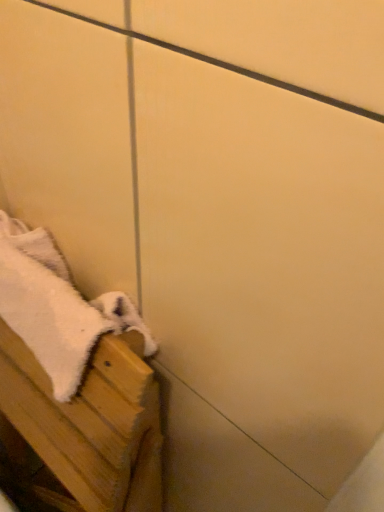
The image size is (384, 512). What do you see at coordinates (56, 307) in the screenshot? I see `white fluffy towel at lower left` at bounding box center [56, 307].

Where is `white fluffy towel at lower left`? Image resolution: width=384 pixels, height=512 pixels. white fluffy towel at lower left is located at coordinates (56, 307).

What is the approximate height of white fluffy towel at lower left?

5.61 inches.

Where is `white fluffy towel at lower left`? Image resolution: width=384 pixels, height=512 pixels. white fluffy towel at lower left is located at coordinates (91, 423).

Describe the element at coordinates (91, 423) in the screenshot. The width and height of the screenshot is (384, 512). I see `white fluffy towel at lower left` at that location.

Where is `white fluffy towel at lower left`? This screenshot has height=512, width=384. white fluffy towel at lower left is located at coordinates (56, 307).

Visually, is white fluffy towel at lower left positioned to the left or to the right of white fluffy towel at lower left?

white fluffy towel at lower left is positioned on white fluffy towel at lower left's right side.

Which is in front, white fluffy towel at lower left or white fluffy towel at lower left?

white fluffy towel at lower left is in front.

Which is in front, point (6, 323) or point (56, 443)?

The point (56, 443) is more forward.

From the image's perspective, is white fluffy towel at lower left on white fluffy towel at lower left?

Yes, from the image's perspective, white fluffy towel at lower left is over white fluffy towel at lower left.

From a real-world perspective, which object rests below the other?

In real-world perspective, white fluffy towel at lower left is lower.

Which of these two, white fluffy towel at lower left or white fluffy towel at lower left, is wider?

white fluffy towel at lower left.

From the picture: Which of these two, white fluffy towel at lower left or white fluffy towel at lower left, stands shorter?

white fluffy towel at lower left.

Which of these two, white fluffy towel at lower left or white fluffy towel at lower left, is smaller?

white fluffy towel at lower left.

Is white fluffy towel at lower left inside or outside of white fluffy towel at lower left?

white fluffy towel at lower left fits inside white fluffy towel at lower left.

Can you see white fluffy towel at lower left touching white fluffy towel at lower left?

Yes, the surface of white fluffy towel at lower left is in contact with white fluffy towel at lower left.

Could you tell me if white fluffy towel at lower left is turned towards white fluffy towel at lower left?

Yes, white fluffy towel at lower left faces towards white fluffy towel at lower left.

How far apart are white fluffy towel at lower left and white fluffy towel at lower left?

They are 3.17 inches apart.

I want to click on bath towel located on the right of white fluffy towel at lower left, so click(x=56, y=307).

Is white fluffy towel at lower left to the right of white fluffy towel at lower left from the viewer's perspective?

No, white fluffy towel at lower left is not to the right of white fluffy towel at lower left.

Relative to white fluffy towel at lower left, is white fluffy towel at lower left in front or behind?

In the image, white fluffy towel at lower left appears in front of white fluffy towel at lower left.

Is point (46, 425) in front of point (9, 296)?

No, (46, 425) is further to viewer.

From the image's perspective, relative to white fluffy towel at lower left, is white fluffy towel at lower left above or below?

white fluffy towel at lower left is situated lower than white fluffy towel at lower left in the image.

From a real-world perspective, is white fluffy towel at lower left beneath white fluffy towel at lower left?

Indeed, from a real-world perspective, white fluffy towel at lower left is positioned beneath white fluffy towel at lower left.

Considering the relative sizes of white fluffy towel at lower left and white fluffy towel at lower left in the image provided, is white fluffy towel at lower left thinner than white fluffy towel at lower left?

No.

Which of these two, white fluffy towel at lower left or white fluffy towel at lower left, stands taller?

With more height is white fluffy towel at lower left.

Consider the image. Is white fluffy towel at lower left bigger or smaller than white fluffy towel at lower left?

Clearly, white fluffy towel at lower left is larger in size than white fluffy towel at lower left.

Would you say white fluffy towel at lower left is inside or outside white fluffy towel at lower left?

The correct answer is: outside.

Are white fluffy towel at lower left and white fluffy towel at lower left located far from each other?

No, white fluffy towel at lower left is not far away from white fluffy towel at lower left.

Could you tell me if white fluffy towel at lower left is facing white fluffy towel at lower left?

No, white fluffy towel at lower left is not facing towards white fluffy towel at lower left.

How distant is white fluffy towel at lower left from white fluffy towel at lower left?

A distance of 3.17 inches exists between white fluffy towel at lower left and white fluffy towel at lower left.

Where is `bath towel behind the white fluffy towel at lower left`? The width and height of the screenshot is (384, 512). bath towel behind the white fluffy towel at lower left is located at coordinates (56, 307).

In order to click on furniture below the white fluffy towel at lower left (from the image's perspective) in this screenshot , I will do `click(91, 423)`.

Find the location of a particular element. Image resolution: width=384 pixels, height=512 pixels. furniture on the left of white fluffy towel at lower left is located at coordinates (91, 423).